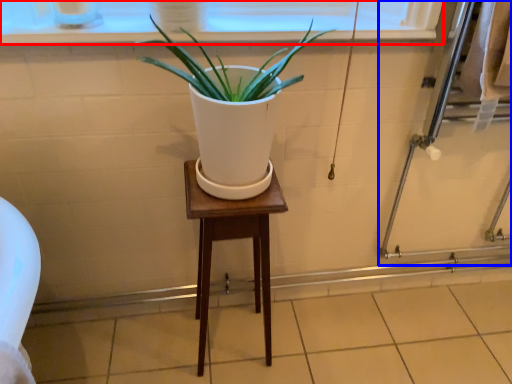
Question: Among these objects, which one is farthest to the camera, window frame (highlighted by a red box) or screen door (highlighted by a blue box)?

Choices:
 (A) window frame
 (B) screen door

Answer: (B)